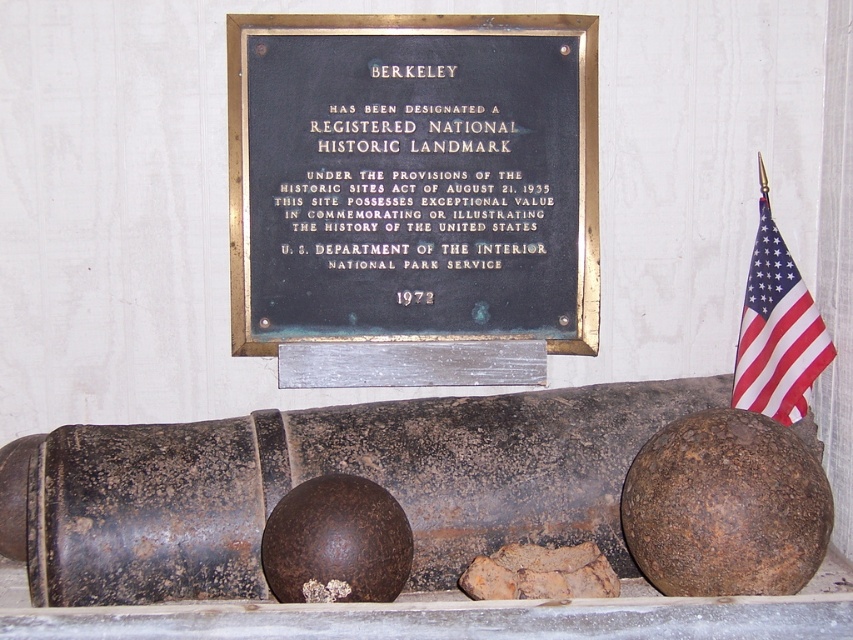
Question: Which point is farther from the camera taking this photo?

Choices:
 (A) (500, 248)
 (B) (764, 371)
 (C) (801, 548)
 (D) (219, 552)

Answer: (A)

Question: Which object is closer to the camera taking this photo?

Choices:
 (A) red fabric flag at right
 (B) black metal plaque at upper center
 (C) rusty metal cannon at center

Answer: (C)

Question: Which object appears farthest from the camera in this image?

Choices:
 (A) black metal plaque at upper center
 (B) rusty metal cannon at center

Answer: (A)

Question: Can you confirm if black metal plaque at upper center is thinner than red fabric flag at right?

Choices:
 (A) yes
 (B) no

Answer: (B)

Question: Is black metal plaque at upper center wider than red fabric flag at right?

Choices:
 (A) yes
 (B) no

Answer: (A)

Question: Can you confirm if black metal plaque at upper center is smaller than red fabric flag at right?

Choices:
 (A) no
 (B) yes

Answer: (A)